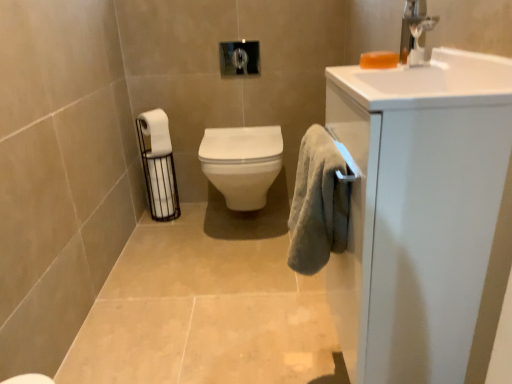
The width and height of the screenshot is (512, 384). Describe the element at coordinates (379, 60) in the screenshot. I see `orange translucent soap at upper right` at that location.

What do you see at coordinates (158, 165) in the screenshot?
I see `white matte toilet paper at left, the 2th toilet paper positioned from the top` at bounding box center [158, 165].

Where is `white glossy cabinet at right`? white glossy cabinet at right is located at coordinates coord(426,214).

This screenshot has width=512, height=384. I want to click on orange translucent soap at upper right, so click(379, 60).

From a real-world perspective, is white matte toilet paper at left, the 2th toilet paper positioned from the top, over white glossy toilet at center?

No, from a real-world perspective, white matte toilet paper at left, the 2th toilet paper positioned from the top, is not above white glossy toilet at center.

Could you tell me if white matte toilet paper at left, the 2th toilet paper positioned from the top, is turned towards white glossy toilet at center?

Yes.

Which is in front, point (424, 16) or point (381, 59)?

The point (424, 16) is in front.

Locate an element on the screen. The width and height of the screenshot is (512, 384). soap that appears below the silver metallic faucet at upper right (from a real-world perspective) is located at coordinates (379, 60).

From the picture: Which of these two, silver metallic faucet at upper right or orange translucent soap at upper right, is wider?

silver metallic faucet at upper right.

Can you confirm if silver metallic faucet at upper right is bigger than orange translucent soap at upper right?

Indeed, silver metallic faucet at upper right has a larger size compared to orange translucent soap at upper right.

Considering the sizes of objects white glossy cabinet at right and orange translucent soap at upper right in the image provided, who is smaller, white glossy cabinet at right or orange translucent soap at upper right?

With smaller size is orange translucent soap at upper right.

Does point (413, 320) appear closer or farther from the camera than point (385, 67)?

Point (413, 320) appears to be closer to the viewer than point (385, 67).

Is white glossy cabinet at right positioned far away from orange translucent soap at upper right?

They are positioned close to each other.

Can you tell me how much white glossy toilet at center and silver metallic faucet at upper right differ in facing direction?

white glossy toilet at center and silver metallic faucet at upper right are facing 87 degrees away from each other.

Considering the sizes of objects white glossy toilet at center and silver metallic faucet at upper right in the image provided, who is shorter, white glossy toilet at center or silver metallic faucet at upper right?

silver metallic faucet at upper right.

Does white glossy toilet at center touch silver metallic faucet at upper right?

white glossy toilet at center and silver metallic faucet at upper right are not in contact.

Based on the photo, considering the sizes of white glossy toilet at center and silver metallic faucet at upper right in the image, is white glossy toilet at center wider or thinner than silver metallic faucet at upper right?

In the image, white glossy toilet at center appears to be wider than silver metallic faucet at upper right.

Can you confirm if orange translucent soap at upper right is bigger than white glossy toilet at center?

Incorrect, orange translucent soap at upper right is not larger than white glossy toilet at center.

Where is `toilet located below the orange translucent soap at upper right (from the image's perspective)`? The width and height of the screenshot is (512, 384). toilet located below the orange translucent soap at upper right (from the image's perspective) is located at coordinates (242, 163).

Can you tell me how much orange translucent soap at upper right and white glossy toilet at center differ in facing direction?

The angle between the facing direction of orange translucent soap at upper right and the facing direction of white glossy toilet at center is 90.7 degrees.

Is white glossy toilet at center at the back of orange translucent soap at upper right?

No, white glossy toilet at center is not at the back of orange translucent soap at upper right.

From a real-world perspective, which is physically below, white matte toilet paper at left, arranged as the first toilet paper when ordered from the bottom, or white glossy cabinet at right?

white matte toilet paper at left, arranged as the first toilet paper when ordered from the bottom, from a real-world perspective.

Considering the points (164, 142) and (367, 113), which point is in front, point (164, 142) or point (367, 113)?

Point (367, 113)

What's the angular difference between white matte toilet paper at left, the 2th toilet paper positioned from the top, and white glossy cabinet at right's facing directions?

white matte toilet paper at left, the 2th toilet paper positioned from the top, and white glossy cabinet at right are facing 127 degrees away from each other.

Considering the relative sizes of white matte toilet paper at left, arranged as the first toilet paper when ordered from the bottom, and white glossy cabinet at right in the image provided, is white matte toilet paper at left, arranged as the first toilet paper when ordered from the bottom, smaller than white glossy cabinet at right?

Correct, white matte toilet paper at left, arranged as the first toilet paper when ordered from the bottom, occupies less space than white glossy cabinet at right.

In terms of size, does silver metallic faucet at upper right appear bigger or smaller than white glossy toilet at center?

Considering their sizes, silver metallic faucet at upper right takes up less space than white glossy toilet at center.

Is silver metallic faucet at upper right positioned with its back to white glossy toilet at center?

No, silver metallic faucet at upper right is not facing the opposite direction of white glossy toilet at center.

Is white glossy toilet at center a part of silver metallic faucet at upper right?

No, white glossy toilet at center is not surrounded by silver metallic faucet at upper right.

Can you confirm if silver metallic faucet at upper right is shorter than white glossy toilet at center?

Indeed, silver metallic faucet at upper right has a lesser height compared to white glossy toilet at center.

What are the coordinates of `toilet on the right of white matte toilet paper at left, arranged as the first toilet paper when ordered from the bottom` in the screenshot? It's located at (242, 163).

You are a GUI agent. You are given a task and a screenshot of the screen. Output one action in this format:
    pyautogui.click(x=<x>, y=<y>)
    Task: Click on the soap on the left of silver metallic faucet at upper right
    
    Given the screenshot: What is the action you would take?
    pyautogui.click(x=379, y=60)

Estimate the real-world distances between objects in this image. Which object is further from white matte toilet paper at left, arranged as the first toilet paper when ordered from the bottom, silver metallic faucet at upper right or orange translucent soap at upper right?

silver metallic faucet at upper right lies further to white matte toilet paper at left, arranged as the first toilet paper when ordered from the bottom, than the other object.

Estimate the real-world distances between objects in this image. Which object is further from white matte toilet paper at left, acting as the second toilet paper starting from the bottom, white glossy cabinet at right or soft gray towel at right?

Among the two, white glossy cabinet at right is located further to white matte toilet paper at left, acting as the second toilet paper starting from the bottom.

Based on their spatial positions, is white matte toilet paper at left, arranged as the first toilet paper when ordered from the bottom, or orange translucent soap at upper right further from white glossy toilet at center?

orange translucent soap at upper right is positioned further to the anchor white glossy toilet at center.

From the image, which object appears to be farther from white glossy toilet at center, white matte toilet paper at left, which is the 1th toilet paper in top-to-bottom order, or white glossy cabinet at right?

white glossy cabinet at right is positioned further to the anchor white glossy toilet at center.

Estimate the real-world distances between objects in this image. Which object is closer to orange translucent soap at upper right, white glossy toilet at center or soft gray towel at right?

soft gray towel at right is positioned closer to the anchor orange translucent soap at upper right.

Based on the photo, looking at the image, which one is located further to white glossy toilet at center, white glossy cabinet at right or soft gray towel at right?

white glossy cabinet at right.

Based on their spatial positions, is white glossy cabinet at right or orange translucent soap at upper right further from white glossy toilet at center?

white glossy cabinet at right is positioned further to the anchor white glossy toilet at center.

Estimate the real-world distances between objects in this image. Which object is further from orange translucent soap at upper right, silver metallic faucet at upper right or white matte toilet paper at left, arranged as the first toilet paper when ordered from the bottom?

Among the two, white matte toilet paper at left, arranged as the first toilet paper when ordered from the bottom, is located further to orange translucent soap at upper right.

Find the location of a particular element. The width and height of the screenshot is (512, 384). tap positioned between soft gray towel at right and white matte toilet paper at left, which is the 1th toilet paper in top-to-bottom order, from near to far is located at coordinates (415, 32).

Where is `toilet paper positioned between silver metallic faucet at upper right and white matte toilet paper at left, arranged as the first toilet paper when ordered from the bottom, from near to far`? The width and height of the screenshot is (512, 384). toilet paper positioned between silver metallic faucet at upper right and white matte toilet paper at left, arranged as the first toilet paper when ordered from the bottom, from near to far is located at coordinates (156, 131).

Find the location of a particular element. Image resolution: width=512 pixels, height=384 pixels. bath towel between white glossy cabinet at right and white matte toilet paper at left, arranged as the first toilet paper when ordered from the bottom, from front to back is located at coordinates (318, 203).

The image size is (512, 384). Identify the location of toilet positioned between white glossy cabinet at right and white matte toilet paper at left, acting as the second toilet paper starting from the bottom, from near to far. pos(242,163).